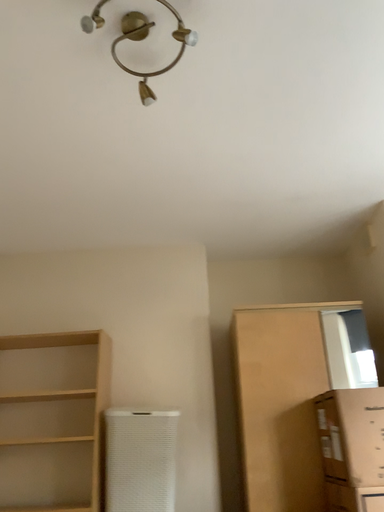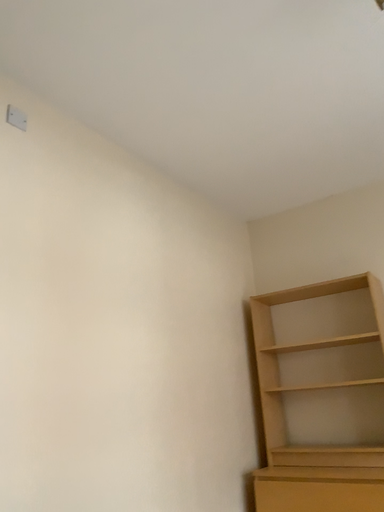
Question: Which way did the camera rotate in the video?

Choices:
 (A) rotated right
 (B) rotated left

Answer: (B)